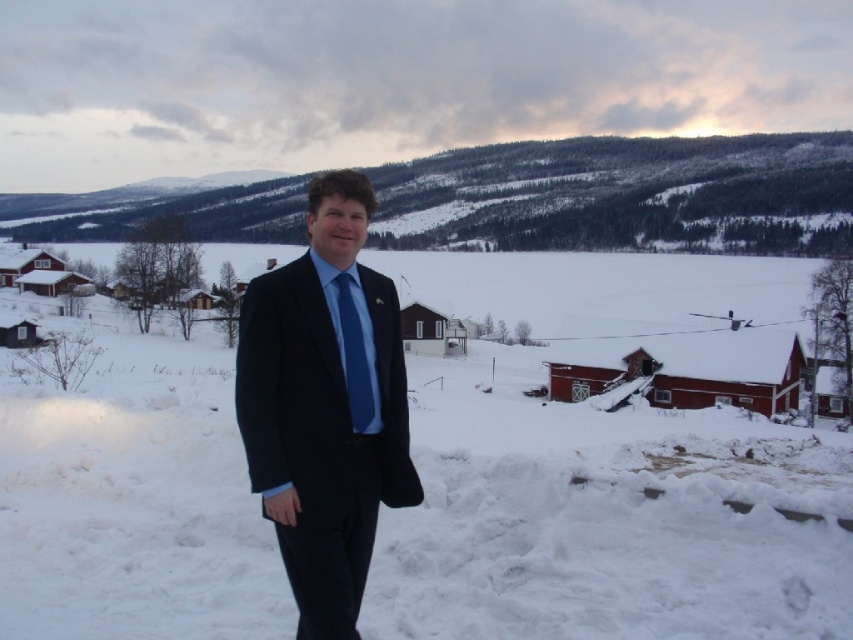
Question: From the image, what is the correct spatial relationship of white fluffy snow at center in relation to blue silk tie at center?

Choices:
 (A) above
 (B) below

Answer: (A)

Question: Is white fluffy snow at center below matte black suit at center?

Choices:
 (A) yes
 (B) no

Answer: (B)

Question: Which point is closer to the camera?

Choices:
 (A) (80, 518)
 (B) (335, 481)
 (C) (351, 355)

Answer: (B)

Question: Which point is farther from the camera taking this photo?

Choices:
 (A) 274,540
 (B) 390,326
 (C) 349,376

Answer: (A)

Question: Which point is closer to the camera?

Choices:
 (A) blue silk tie at center
 (B) matte black suit at center
 (C) white fluffy snow at center

Answer: (B)

Question: Can you confirm if white fluffy snow at center is positioned to the left of blue silk tie at center?

Choices:
 (A) yes
 (B) no

Answer: (B)